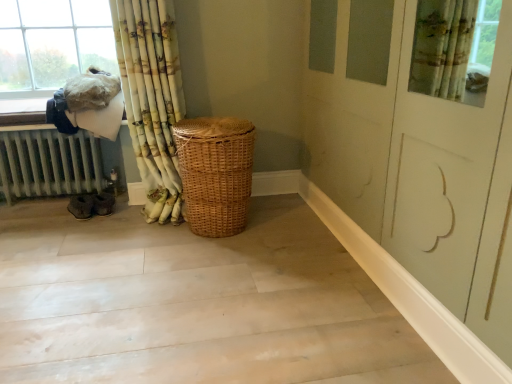
Question: From the image's perspective, is fuzzy white laundry at upper left under white painted metal radiator at left?

Choices:
 (A) no
 (B) yes

Answer: (A)

Question: Does fuzzy white laundry at upper left have a smaller size compared to white painted metal radiator at left?

Choices:
 (A) no
 (B) yes

Answer: (B)

Question: From a real-world perspective, does fuzzy white laundry at upper left stand above white painted metal radiator at left?

Choices:
 (A) yes
 (B) no

Answer: (A)

Question: From the image's perspective, would you say fuzzy white laundry at upper left is positioned over white painted metal radiator at left?

Choices:
 (A) no
 (B) yes

Answer: (B)

Question: Does fuzzy white laundry at upper left have a lesser height compared to white painted metal radiator at left?

Choices:
 (A) yes
 (B) no

Answer: (A)

Question: Is woven natural basket at center to the left or to the right of bamboo curtain at left in the image?

Choices:
 (A) right
 (B) left

Answer: (A)

Question: From the image's perspective, is woven natural basket at center positioned above or below bamboo curtain at left?

Choices:
 (A) below
 (B) above

Answer: (A)

Question: In terms of height, does woven natural basket at center look taller or shorter compared to bamboo curtain at left?

Choices:
 (A) short
 (B) tall

Answer: (A)

Question: From a real-world perspective, relative to bamboo curtain at left, is woven natural basket at center vertically above or below?

Choices:
 (A) above
 (B) below

Answer: (B)

Question: Does point coord(55,180) appear closer or farther from the camera than point coord(249,157)?

Choices:
 (A) farther
 (B) closer

Answer: (A)

Question: From their relative heights in the image, would you say white painted metal radiator at left is taller or shorter than woven natural basket at center?

Choices:
 (A) short
 (B) tall

Answer: (A)

Question: Considering their positions, is white painted metal radiator at left located in front of or behind woven natural basket at center?

Choices:
 (A) front
 (B) behind

Answer: (B)

Question: Is white painted metal radiator at left inside the boundaries of woven natural basket at center, or outside?

Choices:
 (A) outside
 (B) inside

Answer: (A)

Question: Considering the relative positions of white painted metal radiator at left and bamboo curtain at left in the image provided, is white painted metal radiator at left to the left or to the right of bamboo curtain at left?

Choices:
 (A) left
 (B) right

Answer: (A)

Question: From the image's perspective, is white painted metal radiator at left located above or below bamboo curtain at left?

Choices:
 (A) above
 (B) below

Answer: (B)